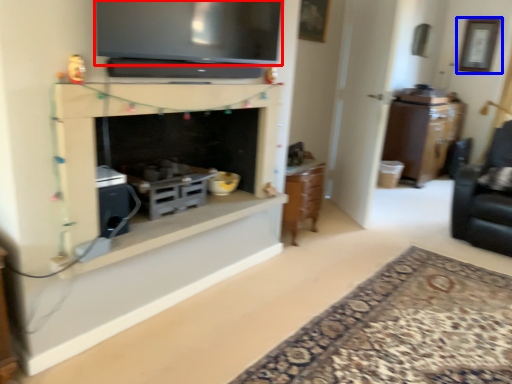
Question: Which object is closer to the camera taking this photo, television (highlighted by a red box) or picture frame (highlighted by a blue box)?

Choices:
 (A) television
 (B) picture frame

Answer: (A)